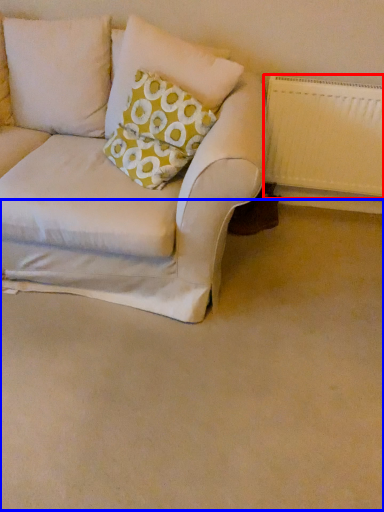
Question: Which object appears farthest to the camera in this image, radiator (highlighted by a red box) or plain (highlighted by a blue box)?

Choices:
 (A) radiator
 (B) plain

Answer: (A)